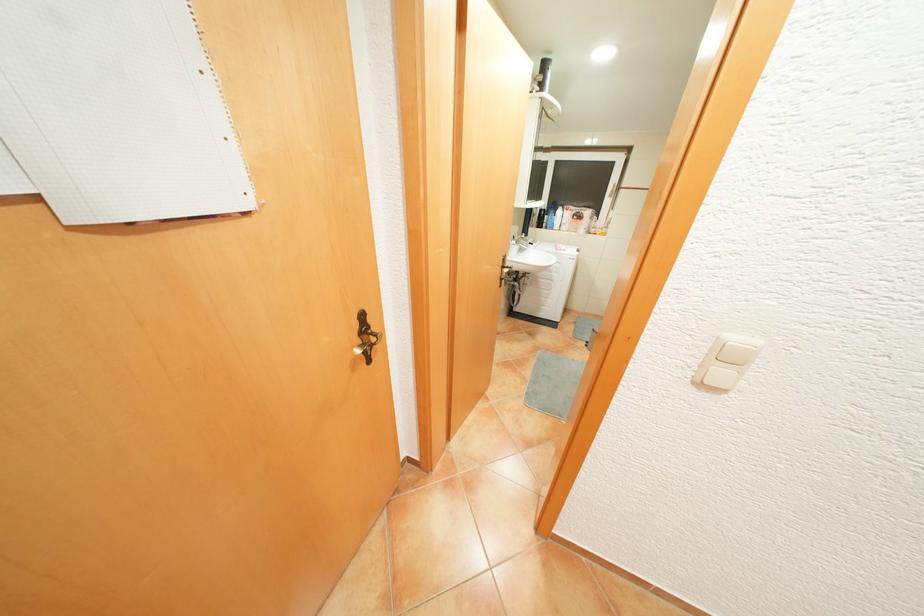
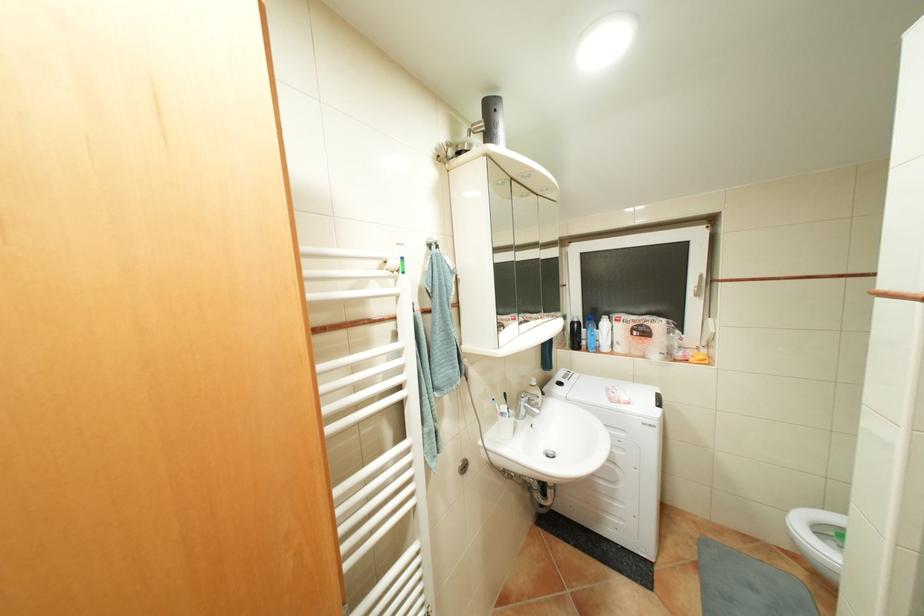
Locate, in the second image, the point that corresponds to the point at 598,213 in the first image.

(667, 323)